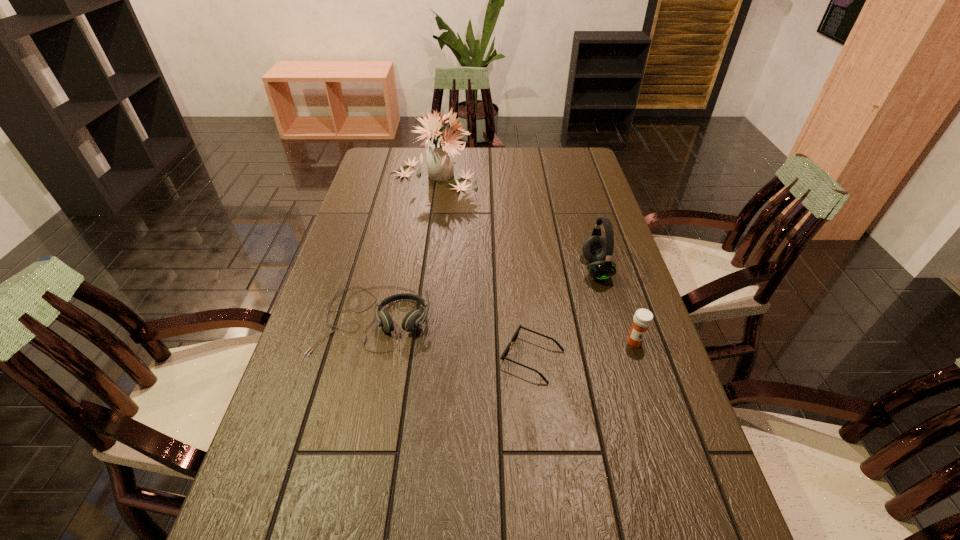
The image size is (960, 540). Find the location of `free point located on the ear cups of the taller headset`. free point located on the ear cups of the taller headset is located at coordinates (482, 269).

The width and height of the screenshot is (960, 540). Find the location of `vacant area situated 0.270m on the ear cups of the taller headset`. vacant area situated 0.270m on the ear cups of the taller headset is located at coordinates (492, 269).

At what (x,y) coordinates should I click in order to perform the action: click on free space located 0.110m on the ear cups of the taller headset. Please return your answer as a coordinate pair (x, y). Looking at the image, I should click on (545, 269).

Where is `free region located on the label side of the medicine`? This screenshot has width=960, height=540. free region located on the label side of the medicine is located at coordinates (644, 373).

The width and height of the screenshot is (960, 540). I want to click on vacant space situated 0.210m on the outer surface of the left headset, so click(x=347, y=438).

Locate an element on the screen. This screenshot has width=960, height=540. vacant area located on the lenses of the sunglasses is located at coordinates (467, 358).

Find the location of `free space located on the lenses of the sunglasses`. free space located on the lenses of the sunglasses is located at coordinates (380, 358).

The image size is (960, 540). Identify the location of vacant region located on the lenses of the sunglasses. (450, 358).

This screenshot has height=540, width=960. I want to click on object situated at the far edge, so click(x=439, y=149).

Image resolution: width=960 pixels, height=540 pixels. Find the location of `bouquet that is positioned at the left edge`. bouquet that is positioned at the left edge is located at coordinates [x=439, y=149].